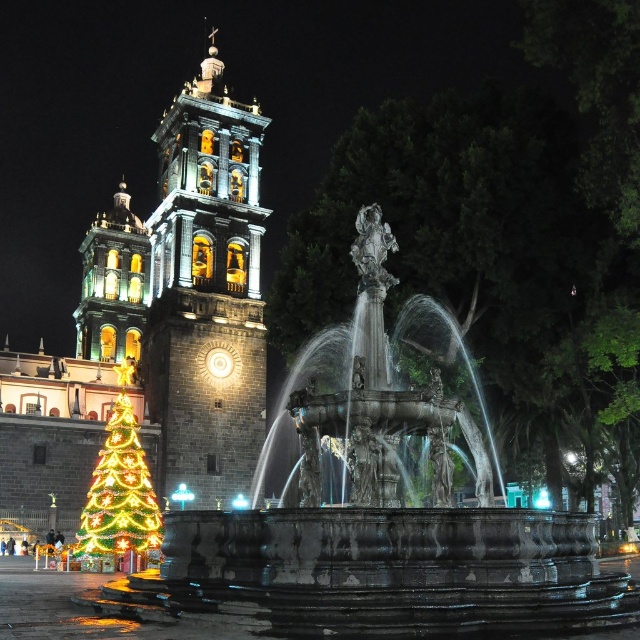
You are standing in the square and want to take a photo of both the polished stone tower at center and the illuminated plastic christmas tree at lower left. Which object should you focus on first to ensure both are in the frame?

You should focus on the polished stone tower at center first because it is closer to you than the illuminated plastic christmas tree at lower left, so adjusting the camera to include it will also capture the tree in the background.

You are a tourist standing at the edge of the square, looking at the polished stone fountain at center and the matte gray church at center. Which structure appears closer to you?

The polished stone fountain at center appears closer because it is smaller than the matte gray church at center, indicating it is nearer to the observer.

You are a photographer setting up equipment in the square. You need to know which object is wider between the polished stone tower at center and the illuminated plastic christmas tree at lower left to decide where to place your tripod. Can you tell me which one is wider?

The polished stone tower at center is wider than the illuminated plastic christmas tree at lower left according to the description.